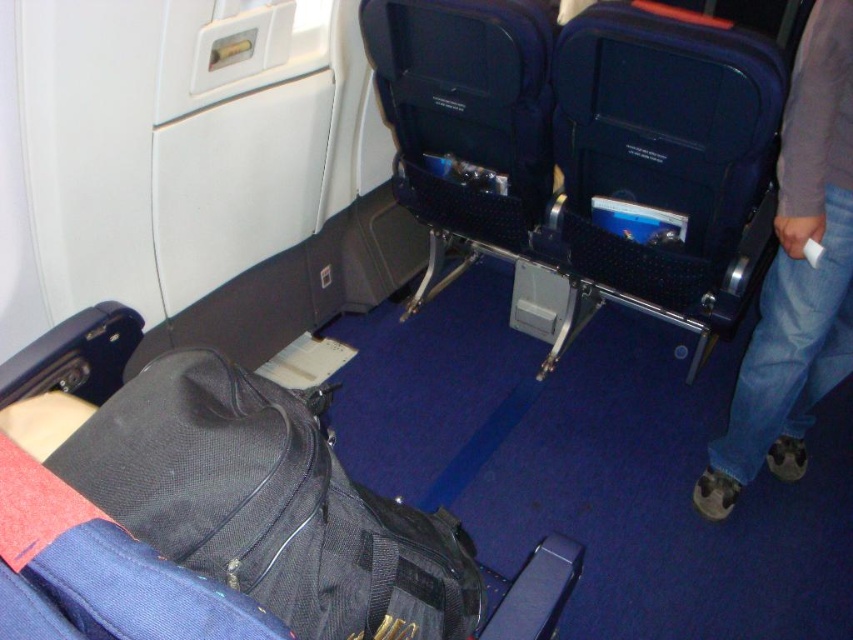
Which is more to the left, black mesh backpack at lower left or jeans at right?

Positioned to the left is black mesh backpack at lower left.

Which of these two, black mesh backpack at lower left or jeans at right, stands taller?

Standing taller between the two is jeans at right.

Does point (170, 540) lie in front of point (729, 419)?

Yes, it is in front of point (729, 419).

You are a GUI agent. You are given a task and a screenshot of the screen. Output one action in this format:
    pyautogui.click(x=<x>, y=<y>)
    Task: Click on the black mesh backpack at lower left
    The image size is (853, 640).
    Given the screenshot: What is the action you would take?
    pyautogui.click(x=268, y=504)